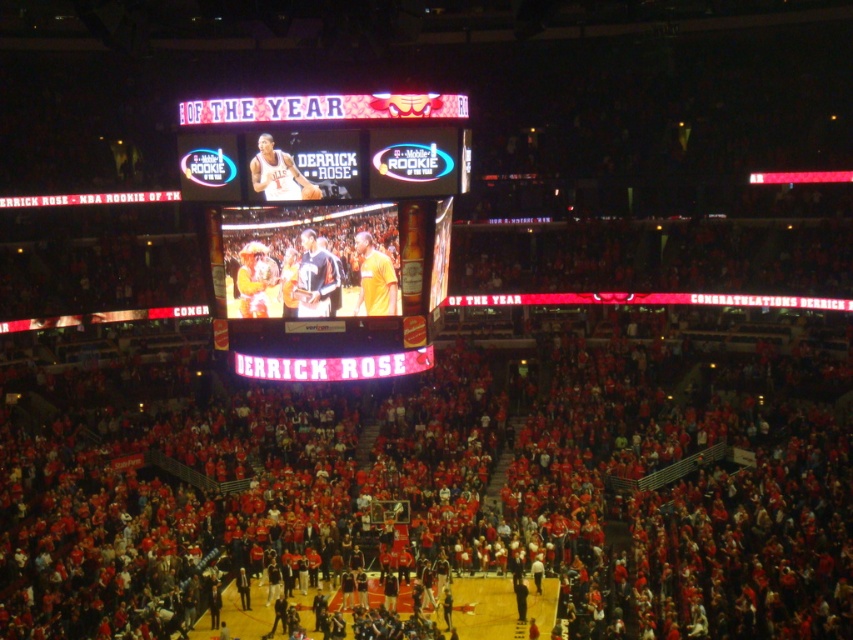
Can you confirm if matte plastic scoreboard at center is positioned to the left of matte white basketball at upper center?

Correct, you'll find matte plastic scoreboard at center to the left of matte white basketball at upper center.

Between point (367, 225) and point (447, 168), which one is positioned in front?

Positioned in front is point (367, 225).

Where is `matte plastic scoreboard at center`? The width and height of the screenshot is (853, 640). matte plastic scoreboard at center is located at coordinates (335, 234).